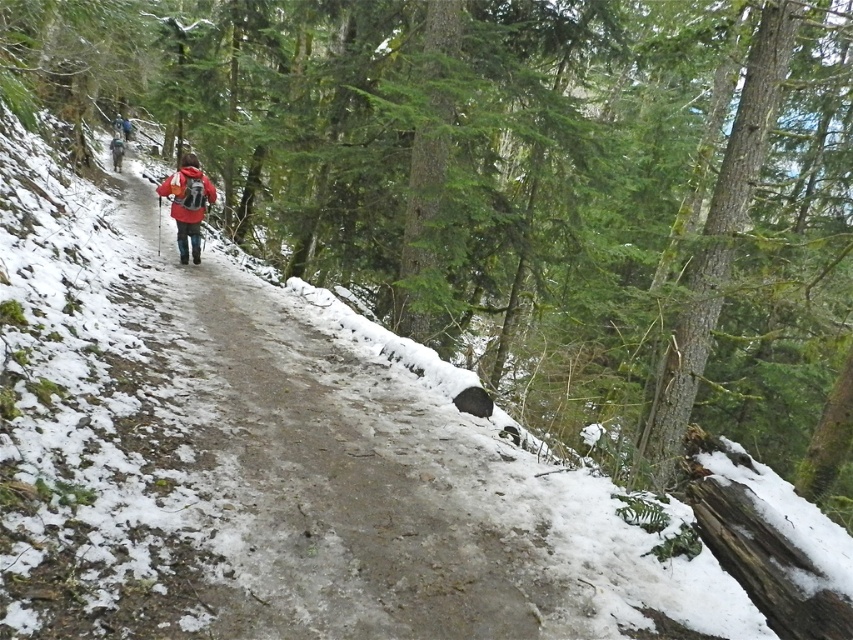
You are a hiker who wants to identify the person in the matte red jacket at center. Which one is it between the two red jackets at center?

The matte red jacket at center is smaller than the red jacket at center, so the smaller one is the matte red jacket at center.